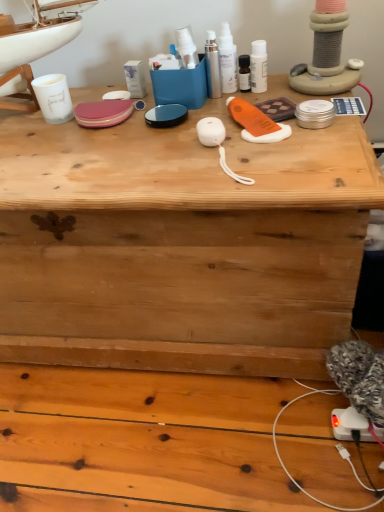
This screenshot has height=512, width=384. Describe the element at coordinates (212, 65) in the screenshot. I see `sleek silver spray at center, arranged as the third toiletry when viewed from the right` at that location.

In order to face white glossy lotion at upper center, which is counted as the 3th toiletry, starting from the left, should I rotate leftwards or rightwards?

It's best to rotate right around 9.000 degrees.

The image size is (384, 512). Find the location of `white glossy spray bottles at upper center, arranged as the 2th toiletry when viewed from the left`. white glossy spray bottles at upper center, arranged as the 2th toiletry when viewed from the left is located at coordinates (227, 60).

Is white glossy lotion at upper center, which is counted as the 3th toiletry, starting from the left, positioned with its back to sleek silver spray at center, arranged as the third toiletry when viewed from the right?

No.

Consider the image. Is the surface of white glossy lotion at upper center, which is counted as the 3th toiletry, starting from the left, in direct contact with sleek silver spray at center, the 1th toiletry viewed from the left?

Yes, white glossy lotion at upper center, which is counted as the 3th toiletry, starting from the left, is in contact with sleek silver spray at center, the 1th toiletry viewed from the left.

From the image's perspective, is white glossy lotion at upper center, which is counted as the 3th toiletry, starting from the left, above sleek silver spray at center, the 1th toiletry viewed from the left?

No.

From a real-world perspective, who is located higher, white glossy lotion at upper center, which is counted as the 3th toiletry, starting from the left, or sleek silver spray at center, the 1th toiletry viewed from the left?

sleek silver spray at center, the 1th toiletry viewed from the left, from a real-world perspective.

What's the angular difference between sleek silver spray at center, the 1th toiletry viewed from the left, and white glossy spray bottles at upper center, acting as the second toiletry starting from the right,'s facing directions?

The facing directions of sleek silver spray at center, the 1th toiletry viewed from the left, and white glossy spray bottles at upper center, acting as the second toiletry starting from the right, are 7.01 degrees apart.

Considering the sizes of objects sleek silver spray at center, the 1th toiletry viewed from the left, and white glossy spray bottles at upper center, acting as the second toiletry starting from the right, in the image provided, who is wider, sleek silver spray at center, the 1th toiletry viewed from the left, or white glossy spray bottles at upper center, acting as the second toiletry starting from the right,?

Wider between the two is white glossy spray bottles at upper center, acting as the second toiletry starting from the right.

Is sleek silver spray at center, arranged as the third toiletry when viewed from the right, located outside white glossy spray bottles at upper center, arranged as the 2th toiletry when viewed from the left?

Indeed, sleek silver spray at center, arranged as the third toiletry when viewed from the right, is completely outside white glossy spray bottles at upper center, arranged as the 2th toiletry when viewed from the left.

Identify the location of the 1st toiletry behind the sleek silver spray at center, the 1th toiletry viewed from the left. (227, 60).

Is there a large distance between white glossy lotion at upper center, positioned as the first toiletry in right-to-left order, and white glossy spray bottles at upper center, arranged as the 2th toiletry when viewed from the left?

white glossy lotion at upper center, positioned as the first toiletry in right-to-left order, is near white glossy spray bottles at upper center, arranged as the 2th toiletry when viewed from the left, not far away.

Find the location of a particular element. The image size is (384, 512). toiletry on the right of white glossy spray bottles at upper center, acting as the second toiletry starting from the right is located at coordinates (258, 66).

Can we say white glossy lotion at upper center, which is counted as the 3th toiletry, starting from the left, lies outside white glossy spray bottles at upper center, acting as the second toiletry starting from the right?

white glossy lotion at upper center, which is counted as the 3th toiletry, starting from the left, is positioned outside white glossy spray bottles at upper center, acting as the second toiletry starting from the right.

Does white glossy lotion at upper center, which is counted as the 3th toiletry, starting from the left, turn towards white glossy spray bottles at upper center, acting as the second toiletry starting from the right?

No, white glossy lotion at upper center, which is counted as the 3th toiletry, starting from the left, is not aimed at white glossy spray bottles at upper center, acting as the second toiletry starting from the right.

Is white glossy spray bottles at upper center, acting as the second toiletry starting from the right, far away from white glossy lotion at upper center, positioned as the first toiletry in right-to-left order?

They are positioned close to each other.

Is white glossy spray bottles at upper center, arranged as the 2th toiletry when viewed from the left, situated inside white glossy lotion at upper center, which is counted as the 3th toiletry, starting from the left, or outside?

white glossy spray bottles at upper center, arranged as the 2th toiletry when viewed from the left, cannot be found inside white glossy lotion at upper center, which is counted as the 3th toiletry, starting from the left.

Looking at the image, does white glossy spray bottles at upper center, arranged as the 2th toiletry when viewed from the left, seem bigger or smaller compared to white glossy lotion at upper center, which is counted as the 3th toiletry, starting from the left?

Considering their sizes, white glossy spray bottles at upper center, arranged as the 2th toiletry when viewed from the left, takes up more space than white glossy lotion at upper center, which is counted as the 3th toiletry, starting from the left.

From the image's perspective, which is above, white glossy spray bottles at upper center, arranged as the 2th toiletry when viewed from the left, or white glossy lotion at upper center, which is counted as the 3th toiletry, starting from the left?

white glossy spray bottles at upper center, arranged as the 2th toiletry when viewed from the left.

Measure the distance between white glossy spray bottles at upper center, arranged as the 2th toiletry when viewed from the left, and sleek silver spray at center, the 1th toiletry viewed from the left.

They are 0.83 inches apart.

From the image's perspective, is white glossy spray bottles at upper center, acting as the second toiletry starting from the right, over sleek silver spray at center, the 1th toiletry viewed from the left?

Answer: Yes.

Does point (221, 42) lie behind point (213, 90)?

That is False.

Considering the sizes of objects white glossy spray bottles at upper center, arranged as the 2th toiletry when viewed from the left, and sleek silver spray at center, arranged as the third toiletry when viewed from the right, in the image provided, who is shorter, white glossy spray bottles at upper center, arranged as the 2th toiletry when viewed from the left, or sleek silver spray at center, arranged as the third toiletry when viewed from the right,?

sleek silver spray at center, arranged as the third toiletry when viewed from the right.

From the image's perspective, between sleek silver spray at center, the 1th toiletry viewed from the left, and white glossy lotion at upper center, which is counted as the 3th toiletry, starting from the left, who is located below?

white glossy lotion at upper center, which is counted as the 3th toiletry, starting from the left, is shown below in the image.

Which is behind, sleek silver spray at center, arranged as the third toiletry when viewed from the right, or white glossy lotion at upper center, which is counted as the 3th toiletry, starting from the left?

white glossy lotion at upper center, which is counted as the 3th toiletry, starting from the left, is further from the camera.

How many degrees apart are the facing directions of sleek silver spray at center, the 1th toiletry viewed from the left, and white glossy lotion at upper center, which is counted as the 3th toiletry, starting from the left?

The facing directions of sleek silver spray at center, the 1th toiletry viewed from the left, and white glossy lotion at upper center, which is counted as the 3th toiletry, starting from the left, are 12.3 degrees apart.

Is sleek silver spray at center, arranged as the third toiletry when viewed from the right, taller or shorter than white glossy lotion at upper center, positioned as the first toiletry in right-to-left order?

Clearly, sleek silver spray at center, arranged as the third toiletry when viewed from the right, is taller compared to white glossy lotion at upper center, positioned as the first toiletry in right-to-left order.

Find the location of a particular element. The width and height of the screenshot is (384, 512). the 2nd toiletry behind the sleek silver spray at center, arranged as the third toiletry when viewed from the right, starting your count from the anchor is located at coordinates (258, 66).

I want to click on the 1st toiletry located beneath the white glossy spray bottles at upper center, acting as the second toiletry starting from the right (from a real-world perspective), so click(212, 65).

Considering their positions, is white glossy lotion at upper center, positioned as the first toiletry in right-to-left order, positioned further to white glossy spray bottles at upper center, arranged as the 2th toiletry when viewed from the left, than sleek silver spray at center, arranged as the third toiletry when viewed from the right?

Based on the image, white glossy lotion at upper center, positioned as the first toiletry in right-to-left order, appears to be further to white glossy spray bottles at upper center, arranged as the 2th toiletry when viewed from the left.

When comparing their distances from white glossy lotion at upper center, positioned as the first toiletry in right-to-left order, does sleek silver spray at center, arranged as the third toiletry when viewed from the right, or white glossy spray bottles at upper center, acting as the second toiletry starting from the right, seem further?

sleek silver spray at center, arranged as the third toiletry when viewed from the right, lies further to white glossy lotion at upper center, positioned as the first toiletry in right-to-left order, than the other object.

Considering their positions, is sleek silver spray at center, arranged as the third toiletry when viewed from the right, positioned closer to white glossy spray bottles at upper center, acting as the second toiletry starting from the right, than white glossy lotion at upper center, positioned as the first toiletry in right-to-left order?

sleek silver spray at center, arranged as the third toiletry when viewed from the right.

Considering their positions, is white glossy lotion at upper center, which is counted as the 3th toiletry, starting from the left, positioned closer to sleek silver spray at center, the 1th toiletry viewed from the left, than white glossy spray bottles at upper center, arranged as the 2th toiletry when viewed from the left?

white glossy spray bottles at upper center, arranged as the 2th toiletry when viewed from the left, is closer to sleek silver spray at center, the 1th toiletry viewed from the left.

When comparing their distances from white glossy lotion at upper center, which is counted as the 3th toiletry, starting from the left, does white glossy spray bottles at upper center, arranged as the 2th toiletry when viewed from the left, or sleek silver spray at center, the 1th toiletry viewed from the left, seem further?

sleek silver spray at center, the 1th toiletry viewed from the left, is further to white glossy lotion at upper center, which is counted as the 3th toiletry, starting from the left.

Considering their positions, is white glossy spray bottles at upper center, acting as the second toiletry starting from the right, positioned further to sleek silver spray at center, arranged as the third toiletry when viewed from the right, than white glossy lotion at upper center, positioned as the first toiletry in right-to-left order?

white glossy lotion at upper center, positioned as the first toiletry in right-to-left order, is further to sleek silver spray at center, arranged as the third toiletry when viewed from the right.

Locate an element on the screen. This screenshot has height=512, width=384. toiletry situated between sleek silver spray at center, the 1th toiletry viewed from the left, and white glossy lotion at upper center, which is counted as the 3th toiletry, starting from the left, from left to right is located at coordinates [x=227, y=60].